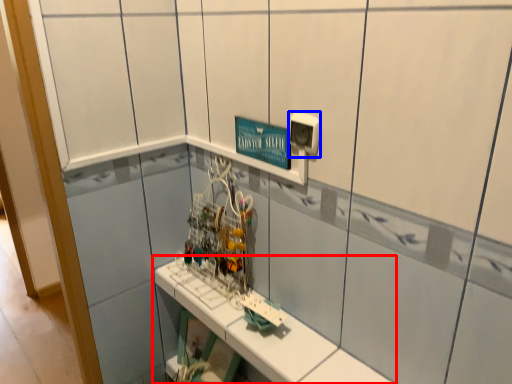
Question: Among these objects, which one is nearest to the camera, shelf (highlighted by a red box) or electric outlet (highlighted by a blue box)?

Choices:
 (A) shelf
 (B) electric outlet

Answer: (A)